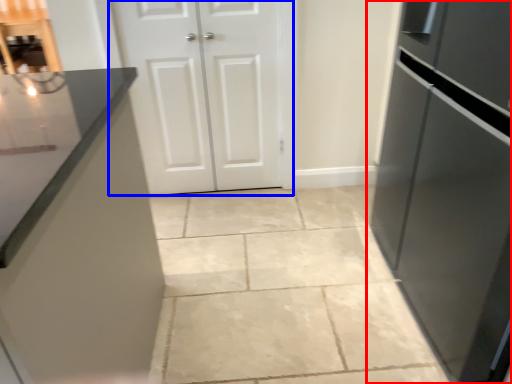
Question: Which of the following is the closest to the observer, refrigerator (highlighted by a red box) or door (highlighted by a blue box)?

Choices:
 (A) refrigerator
 (B) door

Answer: (A)